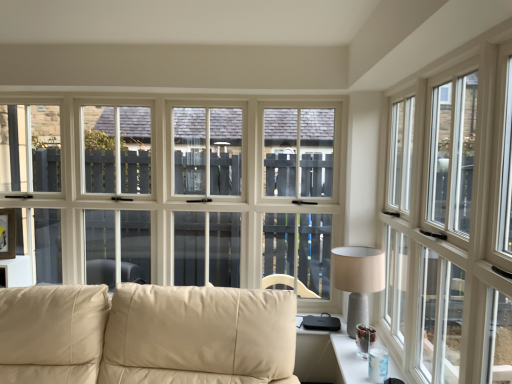
Image resolution: width=512 pixels, height=384 pixels. Describe the element at coordinates (328, 358) in the screenshot. I see `clear glass table at lower right` at that location.

What is the approximate width of white glossy window at right?

white glossy window at right is 3.93 inches in width.

What are the coordinates of `clear glass table at lower right` in the screenshot? It's located at (328, 358).

Is clear glass table at lower right not inside beige fabric lampshade at right?

Yes.

Is clear glass table at lower right smaller than beige fabric lampshade at right?

Yes.

Does clear glass table at lower right have a greater width compared to beige fabric lampshade at right?

In fact, clear glass table at lower right might be narrower than beige fabric lampshade at right.

From the image's perspective, is clear glass table at lower right over beige fabric lampshade at right?

Incorrect, from the image's perspective, clear glass table at lower right is lower than beige fabric lampshade at right.

Considering the positions of objects white glossy window at right and beige leather couch at lower left in the image provided, who is more to the left, white glossy window at right or beige leather couch at lower left?

From the viewer's perspective, beige leather couch at lower left appears more on the left side.

Image resolution: width=512 pixels, height=384 pixels. Identify the location of studio couch that is on the left side of white glossy window at right. (146, 335).

From the image's perspective, which one is positioned lower, white glossy window at right or beige leather couch at lower left?

beige leather couch at lower left, from the image's perspective.

Is white glossy window at right thinner than beige leather couch at lower left?

Correct, the width of white glossy window at right is less than that of beige leather couch at lower left.

From the image's perspective, does clear glass table at lower right appear higher than beige leather couch at lower left?

Actually, clear glass table at lower right appears below beige leather couch at lower left in the image.

Is clear glass table at lower right spatially inside beige leather couch at lower left, or outside of it?

The correct answer is: outside.

How much distance is there between clear glass table at lower right and beige leather couch at lower left?

They are 31.44 inches apart.

Between beige leather couch at lower left and white glossy window at right, which one has larger width?

beige leather couch at lower left.

Where is `studio couch that is on the left side of white glossy window at right`? The height and width of the screenshot is (384, 512). studio couch that is on the left side of white glossy window at right is located at coordinates (146, 335).

Which object is closer to the camera, beige leather couch at lower left or white glossy window at right?

Positioned in front is white glossy window at right.

Is beige leather couch at lower left taller than white glossy window at right?

No.

Considering the sizes of objects beige fabric lampshade at right and white glossy window at right in the image provided, who is thinner, beige fabric lampshade at right or white glossy window at right?

With smaller width is white glossy window at right.

Who is more distant, beige fabric lampshade at right or white glossy window at right?

beige fabric lampshade at right is further from the camera.

Is beige fabric lampshade at right to the left of white glossy window at right from the viewer's perspective?

Yes.

Consider the image. Is beige leather couch at lower left behind clear glass table at lower right?

No, it is not.

From the image's perspective, which object appears higher, beige leather couch at lower left or clear glass table at lower right?

From the image's view, beige leather couch at lower left is above.

How far apart are beige leather couch at lower left and clear glass table at lower right?

beige leather couch at lower left is 31.44 inches away from clear glass table at lower right.

In the scene shown: Can you tell me how much clear glass table at lower right and white glossy window at right differ in facing direction?

0.439 degrees.

From a real-world perspective, is clear glass table at lower right located beneath white glossy window at right?

Correct, in the physical world, clear glass table at lower right is lower than white glossy window at right.

Which is more to the left, clear glass table at lower right or white glossy window at right?

clear glass table at lower right is more to the left.

Can you confirm if clear glass table at lower right is thinner than white glossy window at right?

No, clear glass table at lower right is not thinner than white glossy window at right.

Identify the location of table below the beige fabric lampshade at right (from a real-world perspective). Image resolution: width=512 pixels, height=384 pixels. (328, 358).

Locate an element on the screen. The width and height of the screenshot is (512, 384). window that is in front of the beige leather couch at lower left is located at coordinates (451, 221).

Looking at this image, when comparing their distances from beige leather couch at lower left, does clear glass table at lower right or white glossy window at right seem closer?

clear glass table at lower right.

Looking at this image, which object lies nearer to the anchor point beige fabric lampshade at right, clear glass table at lower right or beige leather couch at lower left?

The object closer to beige fabric lampshade at right is clear glass table at lower right.

Looking at the image, which one is located further to beige fabric lampshade at right, beige leather couch at lower left or clear glass table at lower right?

beige leather couch at lower left is positioned further to the anchor beige fabric lampshade at right.

Which object lies nearer to the anchor point clear glass table at lower right, beige leather couch at lower left or white glossy window at right?

white glossy window at right.

Estimate the real-world distances between objects in this image. Which object is further from clear glass table at lower right, white glossy window at right or beige leather couch at lower left?

beige leather couch at lower left.

Looking at the image, which one is located further to beige leather couch at lower left, white glossy window at right or beige fabric lampshade at right?

white glossy window at right is positioned further to the anchor beige leather couch at lower left.

Which object lies nearer to the anchor point clear glass table at lower right, beige leather couch at lower left or beige fabric lampshade at right?

A: beige fabric lampshade at right.

From the picture: Based on their spatial positions, is clear glass table at lower right or white glossy window at right further from beige fabric lampshade at right?

The object further to beige fabric lampshade at right is white glossy window at right.

The height and width of the screenshot is (384, 512). Identify the location of table between beige leather couch at lower left and white glossy window at right in the horizontal direction. (328, 358).

You are a GUI agent. You are given a task and a screenshot of the screen. Output one action in this format:
    pyautogui.click(x=<x>, y=<y>)
    Task: Click on the table lamp located between beige leather couch at lower left and white glossy window at right in the left-right direction
    
    Given the screenshot: What is the action you would take?
    pyautogui.click(x=357, y=279)

Where is `table between beige leather couch at lower left and beige fabric lampshade at right in the horizontal direction`? This screenshot has width=512, height=384. table between beige leather couch at lower left and beige fabric lampshade at right in the horizontal direction is located at coordinates (328, 358).

This screenshot has height=384, width=512. I want to click on table between white glossy window at right and beige fabric lampshade at right along the z-axis, so click(328, 358).